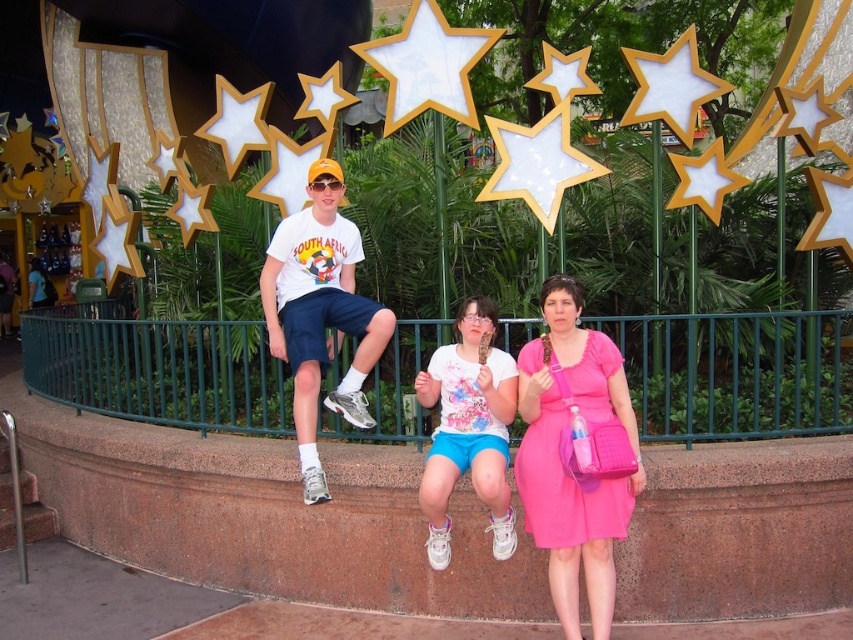
Question: Is pink satin dress at center in front of white matte shirt at center?

Choices:
 (A) yes
 (B) no

Answer: (A)

Question: Which of the following is the closest to the observer?

Choices:
 (A) white cotton t-shirt at upper center
 (B) pink fabric ledge at center
 (C) green metal fence at center
 (D) pink satin dress at center

Answer: (D)

Question: Is pink fabric ledge at center below green metal fence at center?

Choices:
 (A) no
 (B) yes

Answer: (B)

Question: Considering the real-world distances, which object is farthest from the white cotton t-shirt at upper center?

Choices:
 (A) pink fabric ledge at center
 (B) pink satin dress at center
 (C) green metal fence at center

Answer: (A)

Question: Does pink satin dress at center appear on the right side of white cotton t-shirt at upper center?

Choices:
 (A) no
 (B) yes

Answer: (B)

Question: Which point is closer to the camera taking this photo?

Choices:
 (A) (338, 324)
 (B) (224, 449)

Answer: (B)